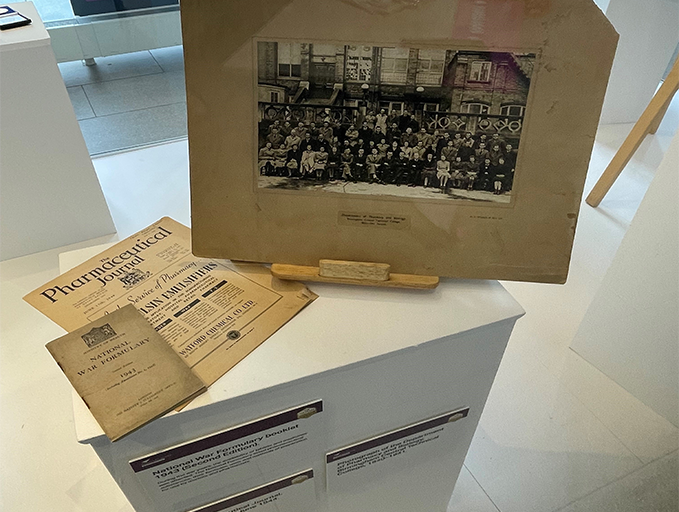
What are the coordinates of `journal` in the screenshot? It's located at (108, 272).